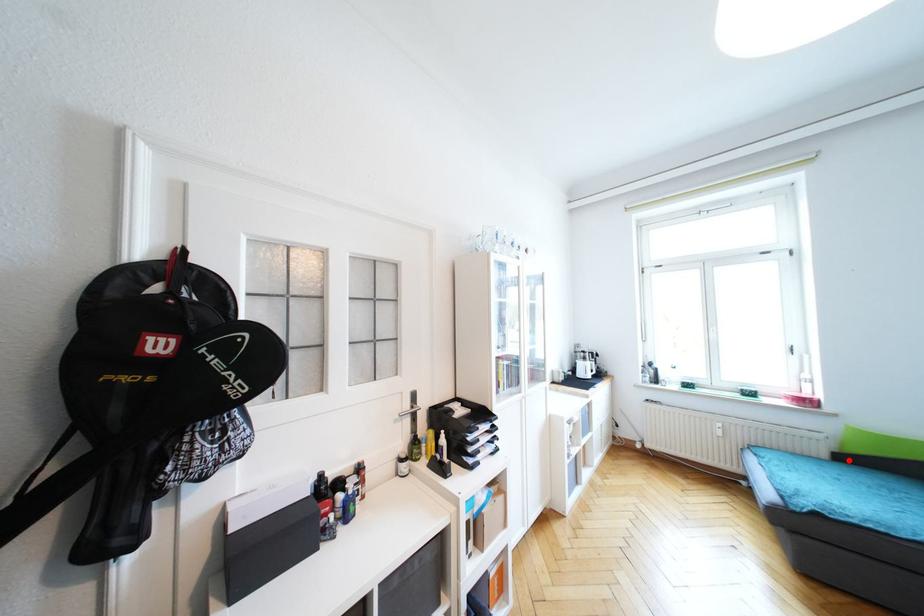
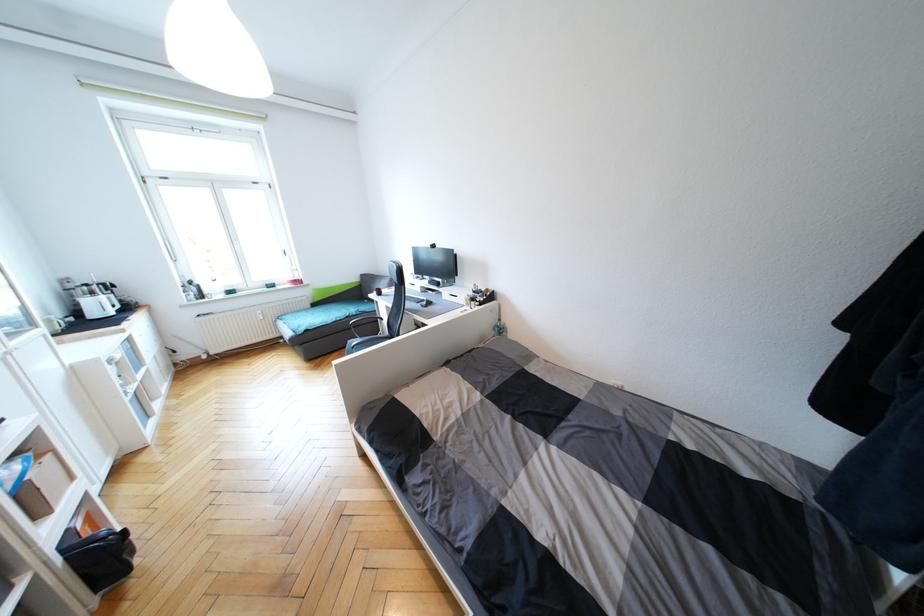
Locate, in the second image, the point that corresponds to the highlighted location in the first image.

(319, 306)